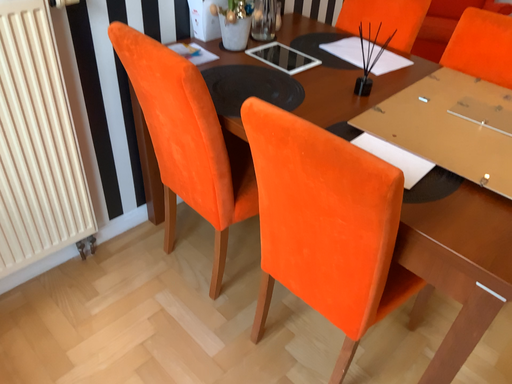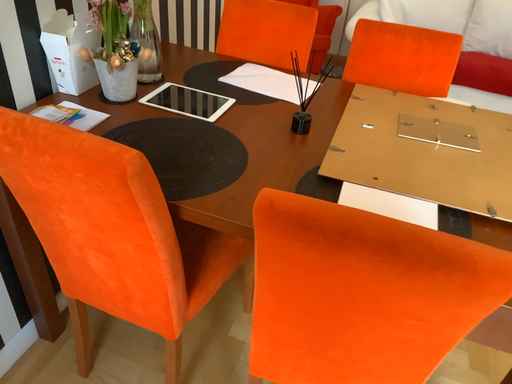
Question: Which way did the camera rotate in the video?

Choices:
 (A) rotated left
 (B) rotated right

Answer: (B)